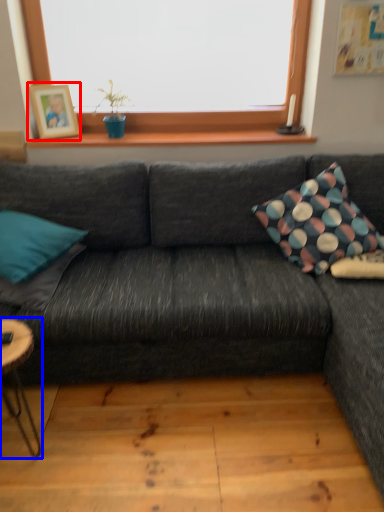
Question: Which point is closer to the camera, picture frame (highlighted by a red box) or coffee table (highlighted by a blue box)?

Choices:
 (A) picture frame
 (B) coffee table

Answer: (B)